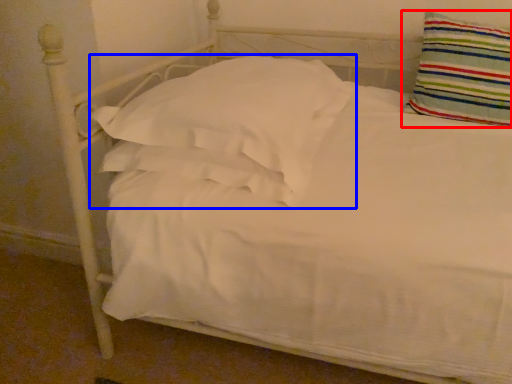
Question: Among these objects, which one is farthest to the camera, pillow (highlighted by a red box) or pillow (highlighted by a blue box)?

Choices:
 (A) pillow
 (B) pillow

Answer: (A)